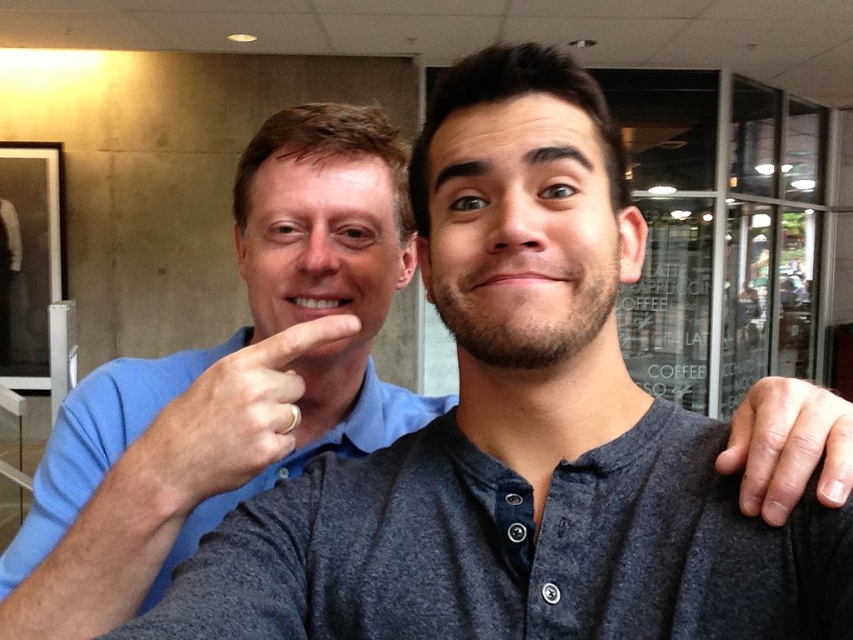
Question: Can you confirm if blue cotton shirt at center is positioned below gold metallic ring at center?

Choices:
 (A) yes
 (B) no

Answer: (A)

Question: Considering the real-world distances, which object is farthest from the gold metallic ring at center?

Choices:
 (A) dry skin at right
 (B) blue cotton shirt at center

Answer: (A)

Question: Among these objects, which one is farthest from the camera?

Choices:
 (A) gold metallic ring at center
 (B) dry skin at right
 (C) blue cotton shirt at center

Answer: (C)

Question: Can you confirm if blue cotton shirt at center is bigger than dry skin at right?

Choices:
 (A) yes
 (B) no

Answer: (A)

Question: Is blue cotton shirt at center positioned in front of dry skin at right?

Choices:
 (A) no
 (B) yes

Answer: (A)

Question: Among these objects, which one is farthest from the camera?

Choices:
 (A) dry skin at right
 (B) gold metallic ring at center
 (C) blue cotton shirt at center

Answer: (C)